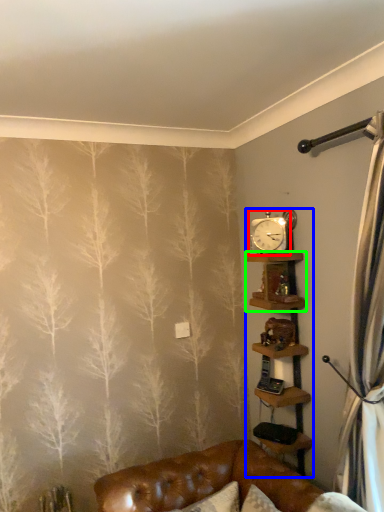
Question: Considering the real-world distances, which object is closest to clock (highlighted by a red box)? shelf (highlighted by a blue box) or shelf (highlighted by a green box).

Choices:
 (A) shelf
 (B) shelf

Answer: (B)